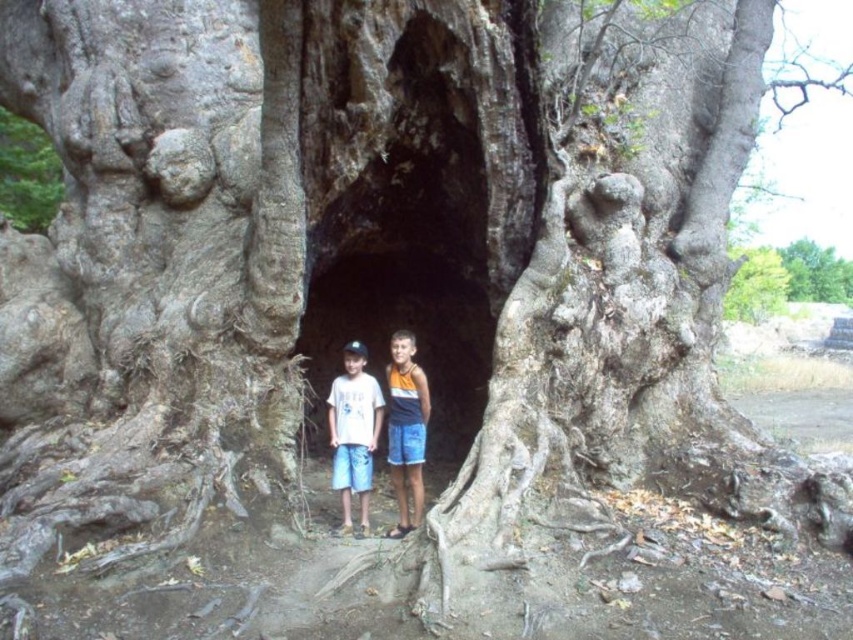
In the scene shown: Is smooth gray bark at center taller than green rough bark tree at upper right?

Incorrect, smooth gray bark at center's height is not larger of green rough bark tree at upper right's.

Based on the photo, who is lower down, smooth gray bark at center or green rough bark tree at upper right?

green rough bark tree at upper right is below.

Who is more forward, (x=39, y=227) or (x=729, y=308)?

Point (x=39, y=227) is more forward.

Identify the location of smooth gray bark at center. The width and height of the screenshot is (853, 640). (27, 173).

Who is higher up, green rough bark tree at upper right or green leafy tree at upper center?

green leafy tree at upper center is above.

Does point (724, 300) lie behind point (793, 269)?

No, (724, 300) is in front of (793, 269).

You are a GUI agent. You are given a task and a screenshot of the screen. Output one action in this format:
    pyautogui.click(x=<x>, y=<y>)
    Task: Click on the green rough bark tree at upper right
    
    Given the screenshot: What is the action you would take?
    pyautogui.click(x=755, y=284)

Is point (415, 472) positioned before point (397, 358)?

No.

Does point (425, 388) come farther from viewer compared to point (393, 355)?

No, it is in front of (393, 355).

You are a GUI agent. You are given a task and a screenshot of the screen. Output one action in this format:
    pyautogui.click(x=<x>, y=<y>)
    Task: Click on the white cotton shorts at center
    The image size is (853, 640).
    Given the screenshot: What is the action you would take?
    pyautogui.click(x=405, y=428)